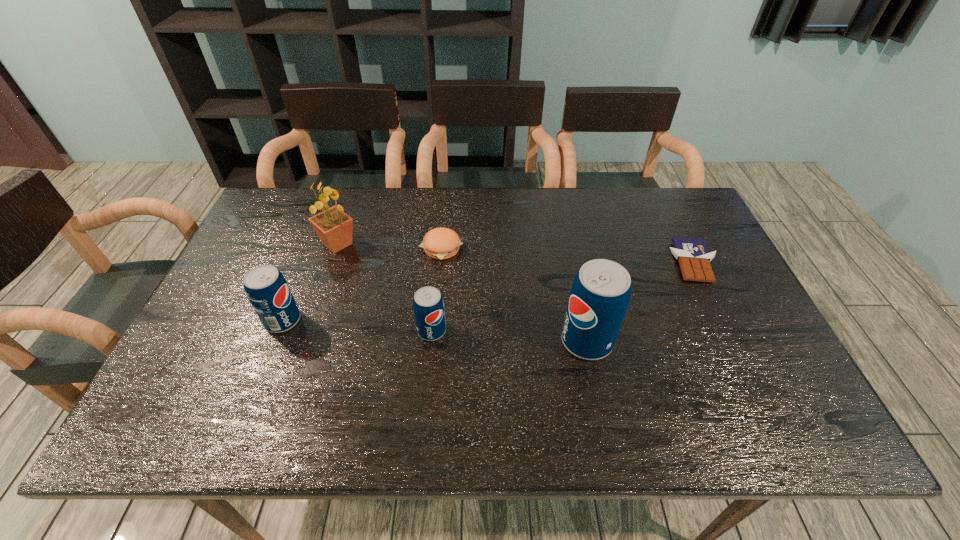
With all pops evenly spaced, where should an extra pop be placed on the right to continue the pattern? Please point out a vacant space. Please provide its 2D coordinates. Your answer should be formatted as a tuple, i.e. [(x, y)], where the tuple contains the x and y coordinates of a point satisfying the conditions above.

[(748, 352)]